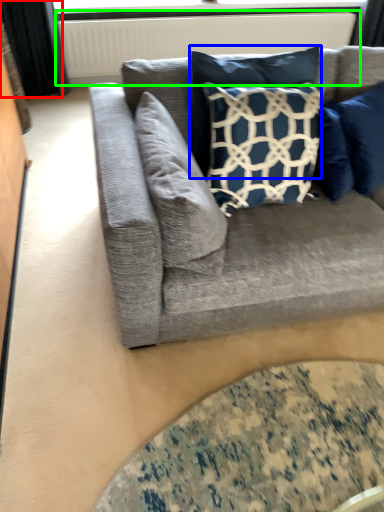
Question: Considering the real-world distances, which object is closest to curtain (highlighted by a red box)? pillow (highlighted by a blue box) or radiator (highlighted by a green box).

Choices:
 (A) pillow
 (B) radiator

Answer: (B)